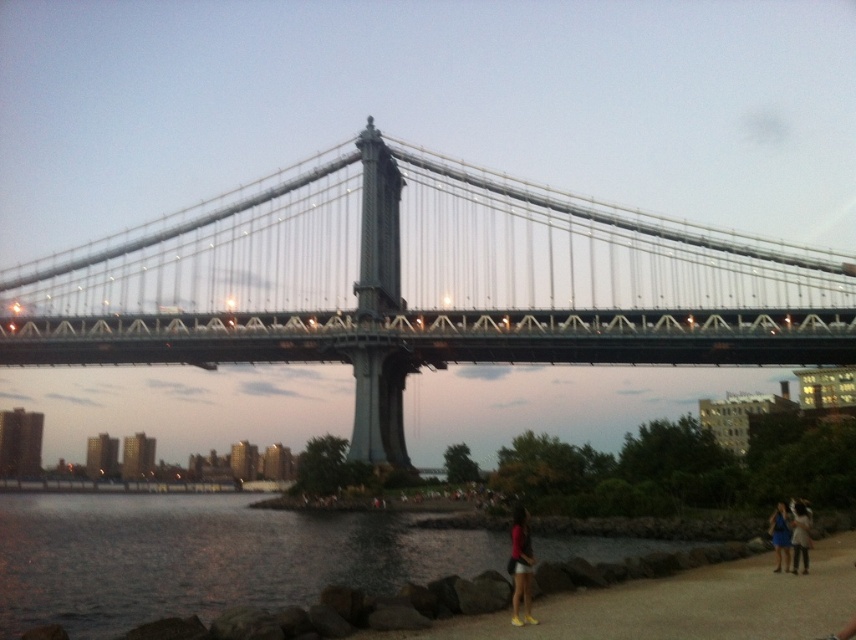
Is the position of black metal bridge at upper center more distant than that of light brown leather jacket at lower right?

Yes.

The image size is (856, 640). What are the coordinates of `black metal bridge at upper center` in the screenshot? It's located at (421, 284).

Who is more distant from viewer, (64, 294) or (807, 540)?

Point (64, 294)

In order to click on black metal bridge at upper center in this screenshot , I will do click(421, 284).

This screenshot has width=856, height=640. What do you see at coordinates (421, 284) in the screenshot?
I see `black metal bridge at upper center` at bounding box center [421, 284].

Which of these two, black metal bridge at upper center or matte pink dress at lower right, stands taller?

Standing taller between the two is black metal bridge at upper center.

This screenshot has height=640, width=856. What do you see at coordinates (421, 284) in the screenshot?
I see `black metal bridge at upper center` at bounding box center [421, 284].

The height and width of the screenshot is (640, 856). I want to click on black metal bridge at upper center, so click(x=421, y=284).

Between light brown leather jacket at lower right and blue fabric dress at lower right, which one has more height?

light brown leather jacket at lower right

What do you see at coordinates (800, 536) in the screenshot?
I see `light brown leather jacket at lower right` at bounding box center [800, 536].

What are the coordinates of `light brown leather jacket at lower right` in the screenshot? It's located at (800, 536).